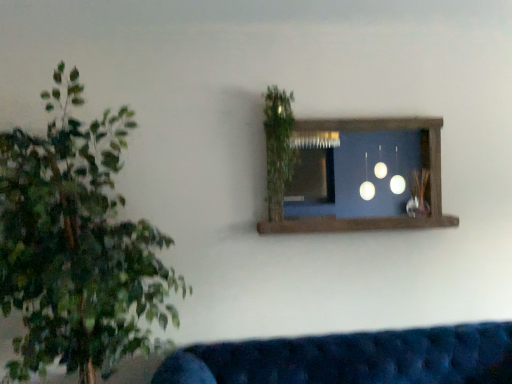
Question: Should I look upward or downward to see green leafy plant at upper center?

Choices:
 (A) down
 (B) up

Answer: (B)

Question: Is velvet blue couch at lower center taller than green leafy plant at upper center?

Choices:
 (A) yes
 (B) no

Answer: (B)

Question: Considering the relative sizes of velvet blue couch at lower center and green leafy plant at upper center in the image provided, is velvet blue couch at lower center wider than green leafy plant at upper center?

Choices:
 (A) yes
 (B) no

Answer: (A)

Question: Does velvet blue couch at lower center have a smaller size compared to green leafy plant at upper center?

Choices:
 (A) yes
 (B) no

Answer: (B)

Question: Is the depth of velvet blue couch at lower center less than that of green leafy plant at upper center?

Choices:
 (A) no
 (B) yes

Answer: (B)

Question: Does velvet blue couch at lower center come behind green leafy plant at upper center?

Choices:
 (A) no
 (B) yes

Answer: (A)

Question: Is velvet blue couch at lower center to the left of green leafy plant at upper center from the viewer's perspective?

Choices:
 (A) yes
 (B) no

Answer: (B)

Question: Does brown wooden window frame at upper center come in front of green leafy plant at upper center?

Choices:
 (A) no
 (B) yes

Answer: (A)

Question: From a real-world perspective, is brown wooden window frame at upper center beneath green leafy plant at upper center?

Choices:
 (A) no
 (B) yes

Answer: (B)

Question: Are brown wooden window frame at upper center and green leafy plant at upper center located far from each other?

Choices:
 (A) yes
 (B) no

Answer: (B)

Question: From the image's perspective, is brown wooden window frame at upper center under green leafy plant at upper center?

Choices:
 (A) no
 (B) yes

Answer: (B)

Question: Does brown wooden window frame at upper center appear on the left side of green leafy plant at upper center?

Choices:
 (A) no
 (B) yes

Answer: (A)

Question: Can you see brown wooden window frame at upper center touching green leafy plant at upper center?

Choices:
 (A) yes
 (B) no

Answer: (B)

Question: Is there a large distance between velvet blue couch at lower center and brown wooden window frame at upper center?

Choices:
 (A) yes
 (B) no

Answer: (B)